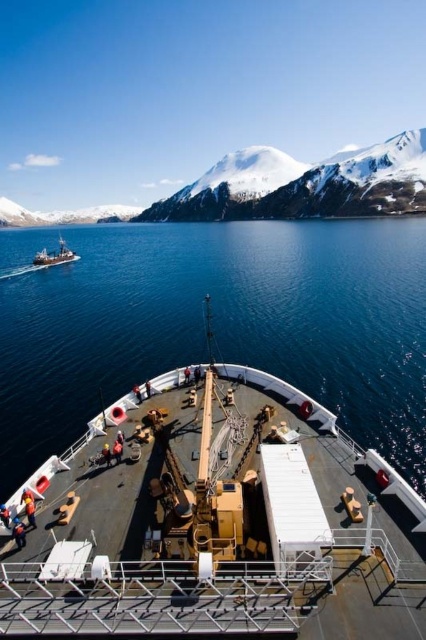
Can you confirm if blue water at center is positioned below snowy white mountain at upper center?

Correct, blue water at center is located below snowy white mountain at upper center.

The height and width of the screenshot is (640, 426). Describe the element at coordinates (215, 323) in the screenshot. I see `blue water at center` at that location.

I want to click on blue water at center, so click(x=215, y=323).

Does point (42, 294) come closer to viewer compared to point (78, 256)?

Yes, point (42, 294) is closer to viewer.

Can you confirm if blue water at center is positioned above metallic gray ship at left?

Incorrect, blue water at center is not positioned above metallic gray ship at left.

You are a GUI agent. You are given a task and a screenshot of the screen. Output one action in this format:
    pyautogui.click(x=<x>, y=<y>)
    Task: Click on the blue water at center
    The height and width of the screenshot is (640, 426).
    Given the screenshot: What is the action you would take?
    pyautogui.click(x=215, y=323)

Who is more distant from viewer, (353,177) or (51,257)?

The point (353,177) is behind.

Between snowy white mountain at upper center and metallic gray ship at left, which one is positioned lower?

metallic gray ship at left

Where is `snowy white mountain at upper center`? The height and width of the screenshot is (640, 426). snowy white mountain at upper center is located at coordinates (304, 186).